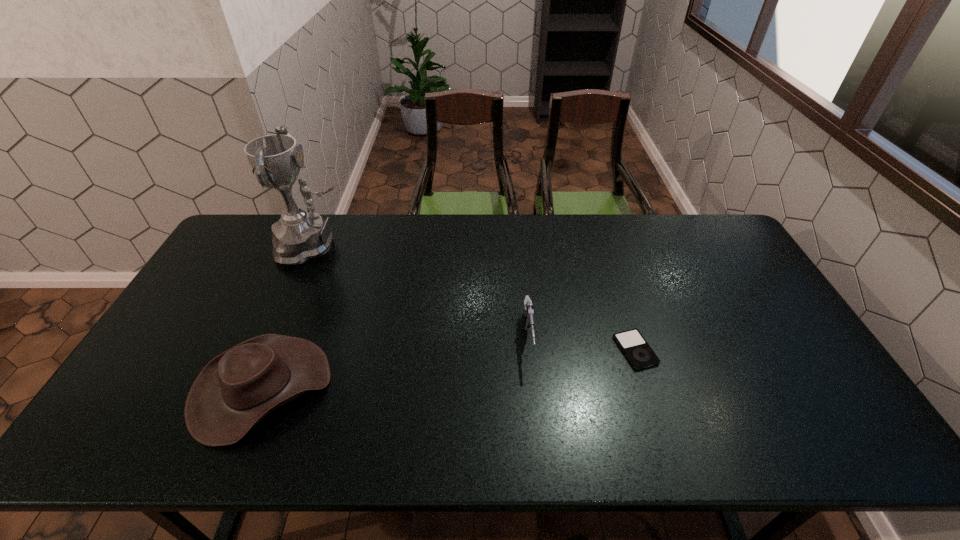
Find the location of a particular element. This screenshot has width=960, height=540. free spot between the shortest object and the cowboy hat is located at coordinates (448, 369).

Find the location of a particular element. The image size is (960, 540). vacant space in between the farthest object and the cowboy hat is located at coordinates (289, 317).

Where is `vacant region between the gun and the tallest object`? The width and height of the screenshot is (960, 540). vacant region between the gun and the tallest object is located at coordinates (421, 292).

The width and height of the screenshot is (960, 540). What are the coordinates of `free area in between the shortest object and the farthest object` in the screenshot? It's located at (475, 298).

Locate an element on the screen. This screenshot has width=960, height=540. vacant region between the iPod and the second object from right to left is located at coordinates (582, 344).

The image size is (960, 540). What are the coordinates of `free space that is in between the tallest object and the third object from left to right` in the screenshot? It's located at (421, 292).

Locate an element on the screen. This screenshot has height=540, width=960. free space between the shortest object and the tallest object is located at coordinates (475, 298).

This screenshot has height=540, width=960. I want to click on free space between the gun and the cowboy hat, so click(396, 363).

Identify the location of object that is the closest to the cowboy hat. This screenshot has width=960, height=540. (300, 235).

Locate an element on the screen. Image resolution: width=960 pixels, height=540 pixels. the second closest object to the gun is located at coordinates (237, 389).